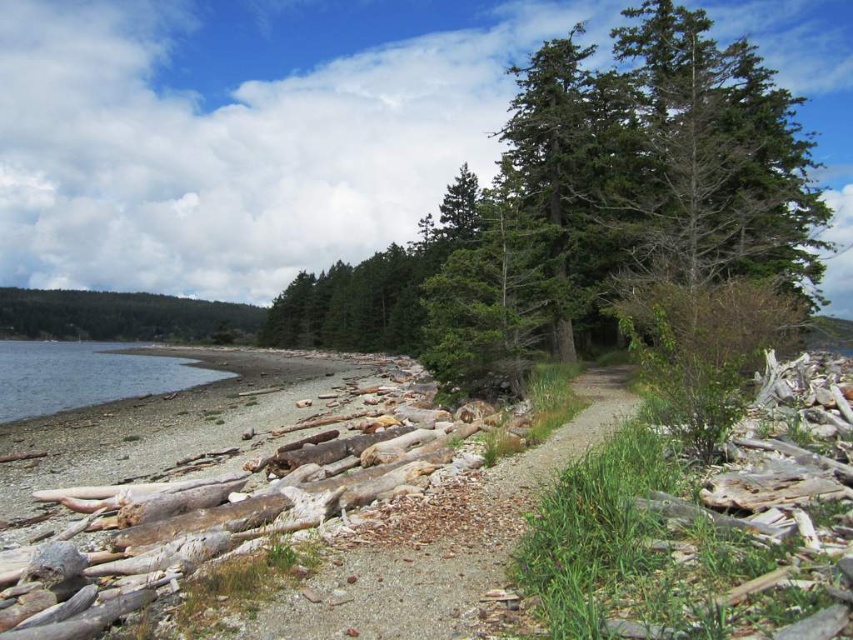
Question: Can you confirm if green textured tree at upper center is thinner than clear water at lower left?

Choices:
 (A) yes
 (B) no

Answer: (A)

Question: Which object is the closest to the clear water at lower left?

Choices:
 (A) gravelly dirt path at center
 (B) green textured tree at upper center

Answer: (B)

Question: Does green textured tree at upper center appear under gravelly dirt path at center?

Choices:
 (A) no
 (B) yes

Answer: (A)

Question: Which point is closer to the camera?

Choices:
 (A) gravelly dirt path at center
 (B) clear water at lower left

Answer: (A)

Question: Is green textured tree at upper center behind gravelly dirt path at center?

Choices:
 (A) yes
 (B) no

Answer: (A)

Question: Which object appears closest to the camera in this image?

Choices:
 (A) gravelly dirt path at center
 (B) clear water at lower left

Answer: (A)